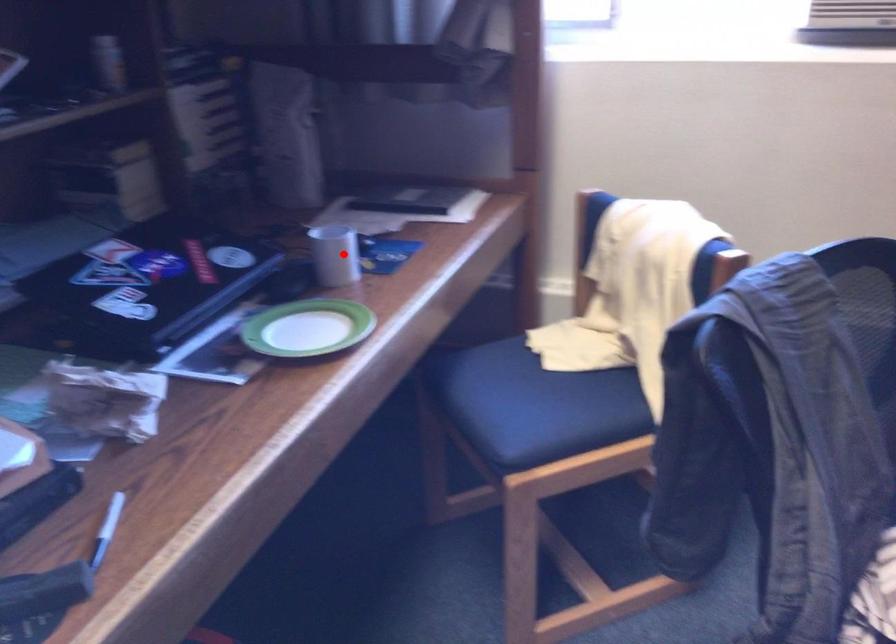
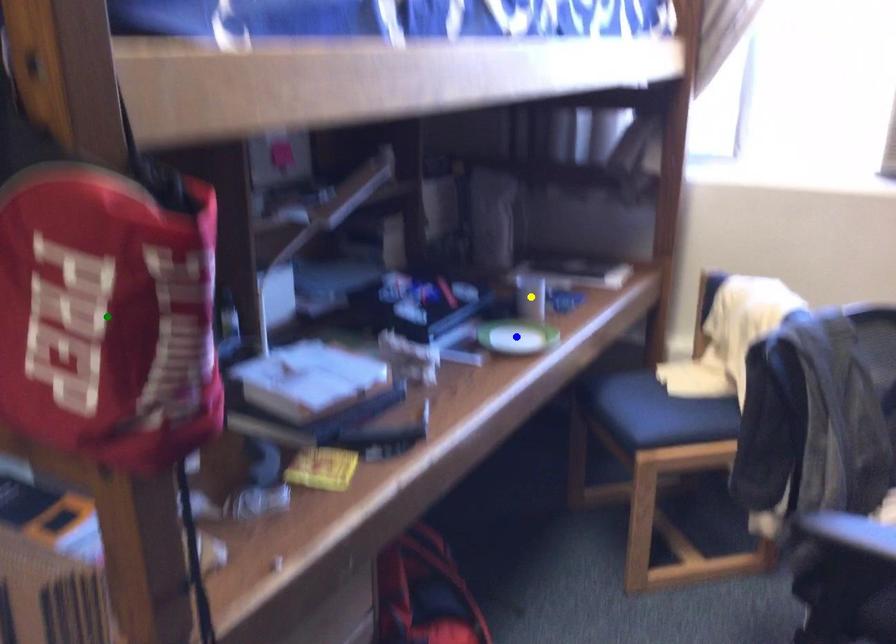
Question: I am providing you with two images of the same scene from different viewpoints. A red point is marked on the first image. You are given multiple points on the second image. Which point in image 2 is actually the same real-world point as the red point in image 1?

Choices:
 (A) yellow point
 (B) blue point
 (C) green point

Answer: (A)